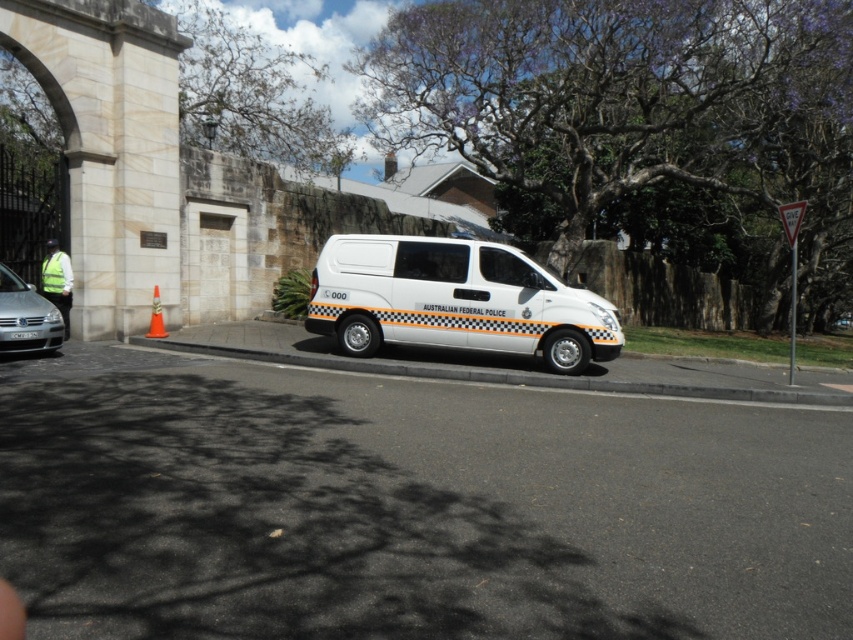
Who is taller, white matte van at center or orange plastic cone at lower left?

white matte van at center

Which is below, white matte van at center or orange plastic cone at lower left?

Positioned lower is orange plastic cone at lower left.

Does point (514, 260) come in front of point (155, 289)?

Yes, point (514, 260) is closer to viewer.

The height and width of the screenshot is (640, 853). I want to click on white matte van at center, so click(x=454, y=300).

Is white matte van at center positioned behind white asphalt curb at lower center?

Yes.

Does white matte van at center have a lesser width compared to white asphalt curb at lower center?

Correct, white matte van at center's width is less than white asphalt curb at lower center's.

Who is more forward, (x=512, y=333) or (x=444, y=372)?

Point (x=444, y=372) is more forward.

Where is `white matte van at center`? The image size is (853, 640). white matte van at center is located at coordinates (454, 300).

Does white asphalt curb at lower center lie in front of silver metallic sedan at lower left?

Yes, it is in front of silver metallic sedan at lower left.

Who is more forward, (450, 371) or (33, 326)?

Positioned in front is point (450, 371).

The image size is (853, 640). Find the location of `white asphalt curb at lower center`. white asphalt curb at lower center is located at coordinates (502, 376).